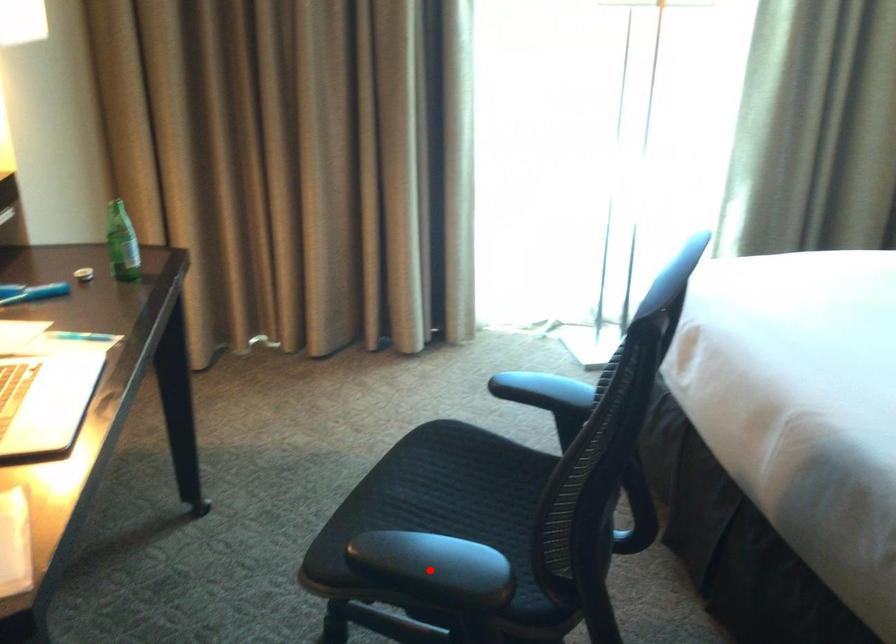
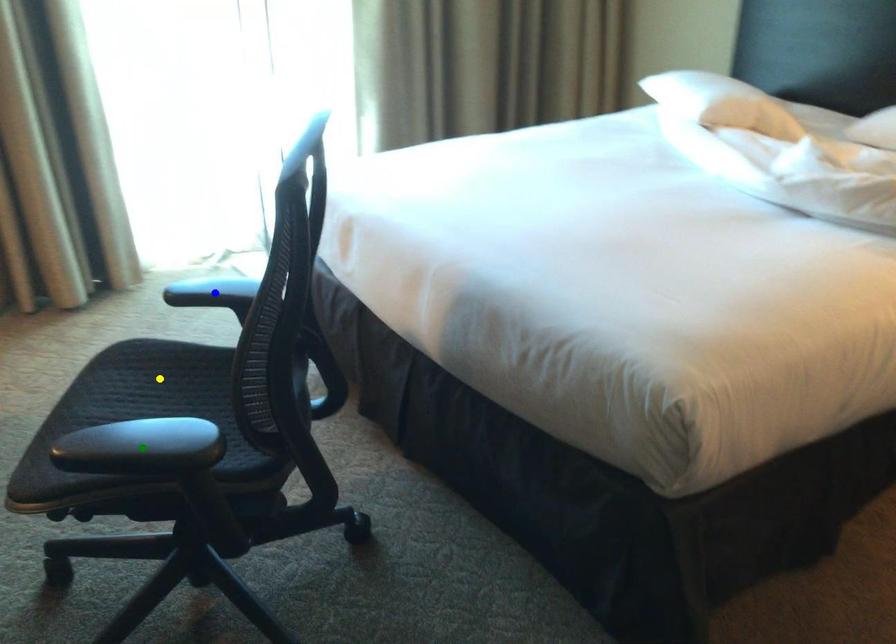
Question: I am providing you with two images of the same scene from different viewpoints. A red point is marked on the first image. You are given multiple points on the second image. Can you choose the point in image 2 that corresponds to the point in image 1?

Choices:
 (A) yellow point
 (B) green point
 (C) blue point

Answer: (B)